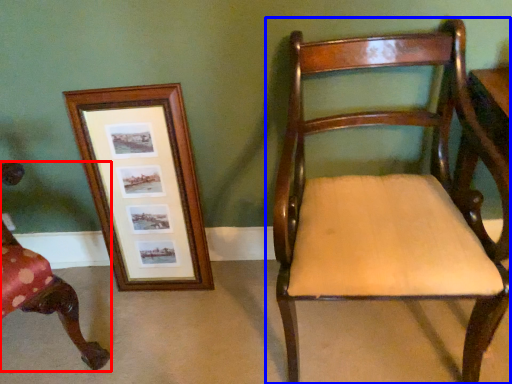
Question: Which point is further to the camera, chair (highlighted by a red box) or chair (highlighted by a blue box)?

Choices:
 (A) chair
 (B) chair

Answer: (A)